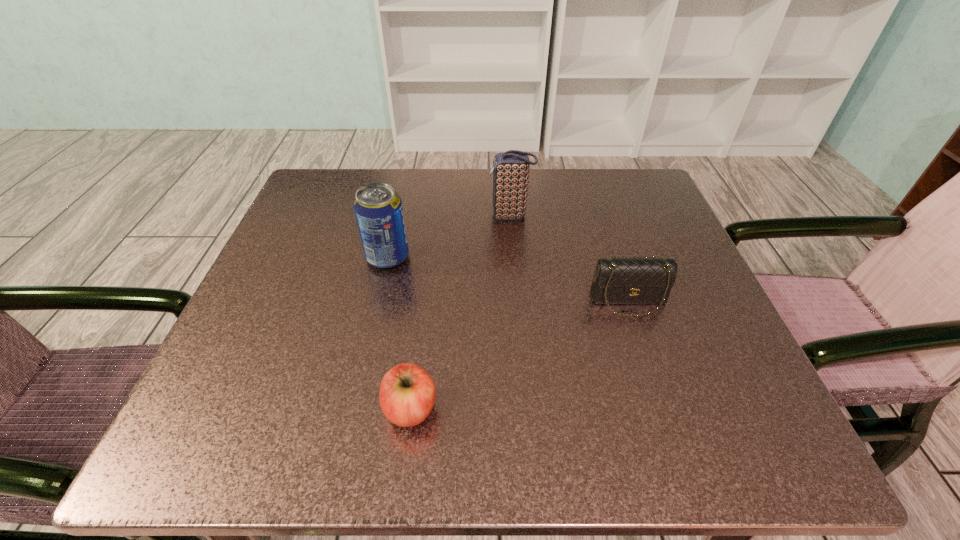
Locate an element on the screen. The width and height of the screenshot is (960, 540). vacant space at the right edge of the desktop is located at coordinates (703, 335).

This screenshot has height=540, width=960. Identify the location of free space at the near left corner of the desktop. (217, 403).

You are a GUI agent. You are given a task and a screenshot of the screen. Output one action in this format:
    pyautogui.click(x=<x>, y=<y>)
    Task: Click on the blank space at the far right corner of the desktop
    The width and height of the screenshot is (960, 540).
    Given the screenshot: What is the action you would take?
    pyautogui.click(x=619, y=191)

You are a GUI agent. You are given a task and a screenshot of the screen. Output one action in this format:
    pyautogui.click(x=<x>, y=<y>)
    Task: Click on the unoccupied area between the second object from left to right and the left clutch bag
    The height and width of the screenshot is (540, 960).
    Given the screenshot: What is the action you would take?
    pyautogui.click(x=461, y=312)

This screenshot has height=540, width=960. I want to click on vacant space that is in between the rightmost object and the third object from left to right, so click(569, 258).

At what (x,y) coordinates should I click in order to perform the action: click on free space between the second nearest object and the farthest object. Please return your answer as a coordinate pair (x, y). This screenshot has width=960, height=540. Looking at the image, I should click on (569, 258).

Find the location of a particular element. empty location between the nearest object and the second farthest object is located at coordinates (399, 333).

Image resolution: width=960 pixels, height=540 pixels. I want to click on free area in between the second farthest object and the rightmost object, so click(x=508, y=279).

Find the location of a particular element. The image size is (960, 540). vacant space in between the nearer clutch bag and the taller clutch bag is located at coordinates 569,258.

Where is `vacant space that is in between the third object from right to left and the soda`? The height and width of the screenshot is (540, 960). vacant space that is in between the third object from right to left and the soda is located at coordinates (399, 333).